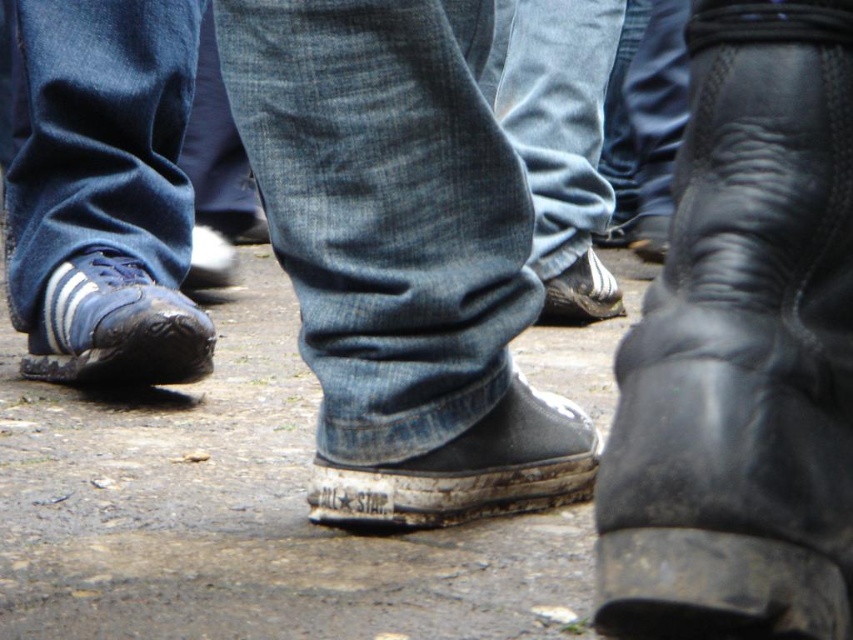
Does dull concrete pavement at center come behind denim jeans at center?

No, dull concrete pavement at center is closer to the viewer.

Can you confirm if dull concrete pavement at center is wider than denim jeans at center?

Yes.

What do you see at coordinates (241, 513) in the screenshot? The width and height of the screenshot is (853, 640). I see `dull concrete pavement at center` at bounding box center [241, 513].

Where is `dull concrete pavement at center`? The height and width of the screenshot is (640, 853). dull concrete pavement at center is located at coordinates (241, 513).

Can you confirm if denim at left is smaller than white leather shoe at center?

Actually, denim at left might be larger than white leather shoe at center.

Who is more forward, (325, 22) or (563, 272)?

Point (325, 22) is more forward.

Does point (140, 182) come in front of point (613, 276)?

Yes, it is.

At what (x,y) coordinates should I click in order to perform the action: click on denim at left. Please return your answer as a coordinate pair (x, y). Looking at the image, I should click on (386, 209).

Image resolution: width=853 pixels, height=640 pixels. Identify the location of dull concrete pavement at center. (241, 513).